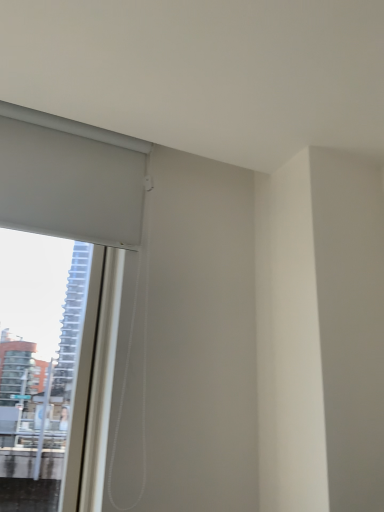
Question: Should I look upward or downward to see white matte window at upper left?

Choices:
 (A) down
 (B) up

Answer: (A)